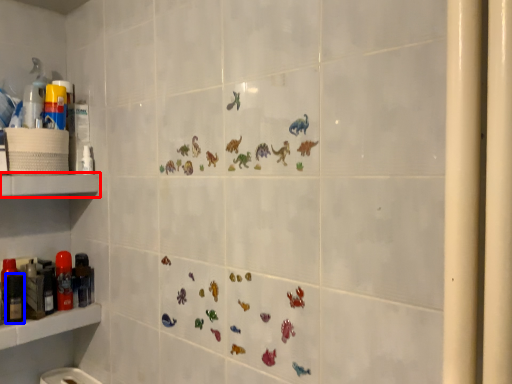
Question: Which object appears farthest to the camera in this image, shelf (highlighted by a red box) or toiletry (highlighted by a blue box)?

Choices:
 (A) shelf
 (B) toiletry

Answer: (B)